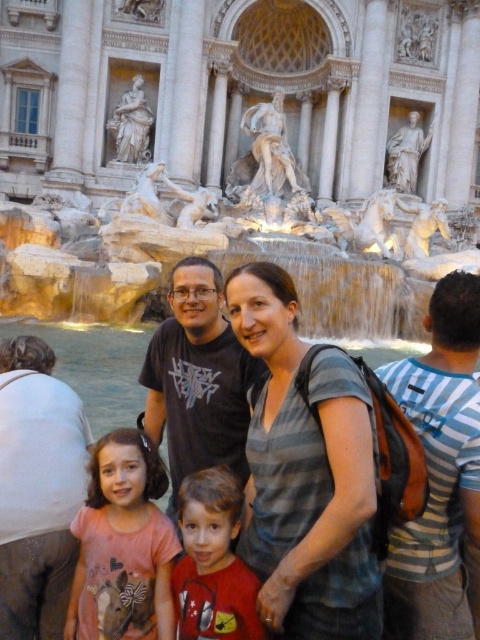
You are standing in front of the Trevi Fountain and want to take a photo. You notice two points marked in the scene. Which point, point [356,451] or point [216,561], is closer to you?

Point [356,451] is closer to the viewer than point [216,561].

You are standing in front of the Trevi Fountain and want to take a photo of the two points marked in the scene. Which point, point (113, 548) or point (231, 589), will appear closer to you in the photo?

Point (113, 548) will appear closer to you in the photo because it is further to the camera than point (231, 589).